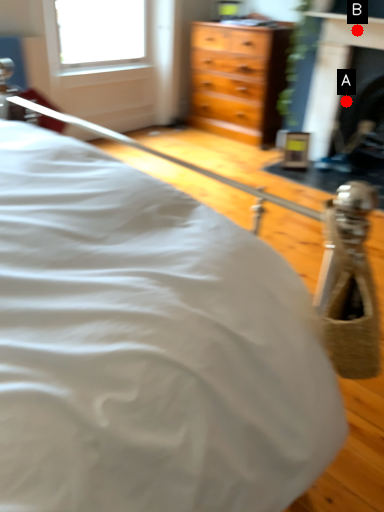
Question: Two points are circled on the image, labeled by A and B beside each circle. Which point is closer to the camera?

Choices:
 (A) A is closer
 (B) B is closer

Answer: (B)